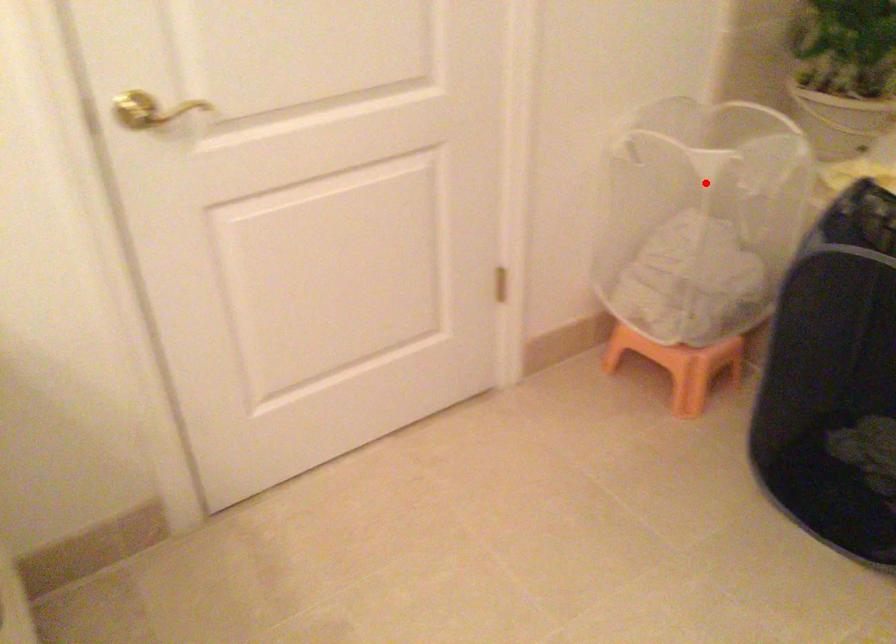
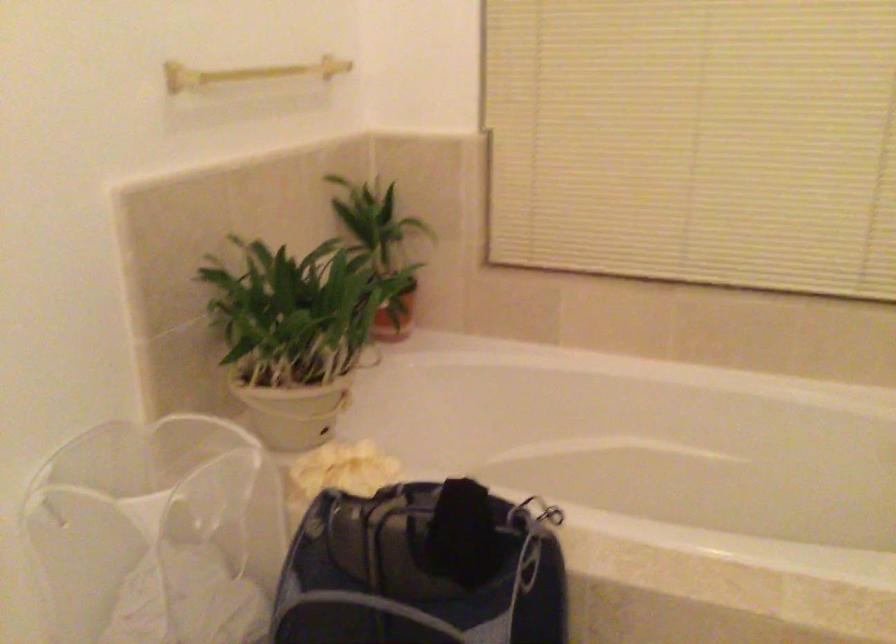
Question: I am providing you with two images of the same scene from different viewpoints. Given a red point in image1, look at the same physical point in image2. Is it:

Choices:
 (A) Closer to the viewpoint
 (B) Farther from the viewpoint

Answer: (A)